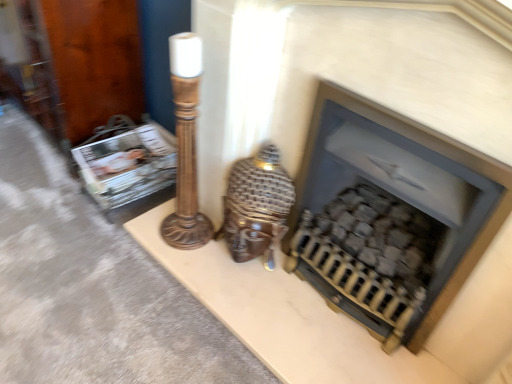
Question: Would you say matte black fireplace at center is inside or outside brown wooden table lamp at center?

Choices:
 (A) inside
 (B) outside

Answer: (B)

Question: Is matte black fireplace at center wider or thinner than brown wooden table lamp at center?

Choices:
 (A) wide
 (B) thin

Answer: (B)

Question: Which of these objects is positioned farthest from the matte plastic magazine at left?

Choices:
 (A) matte black fireplace at center
 (B) brown wooden table lamp at center

Answer: (A)

Question: Which is farther from the brown wooden table lamp at center?

Choices:
 (A) matte plastic magazine at left
 (B) matte black fireplace at center

Answer: (A)